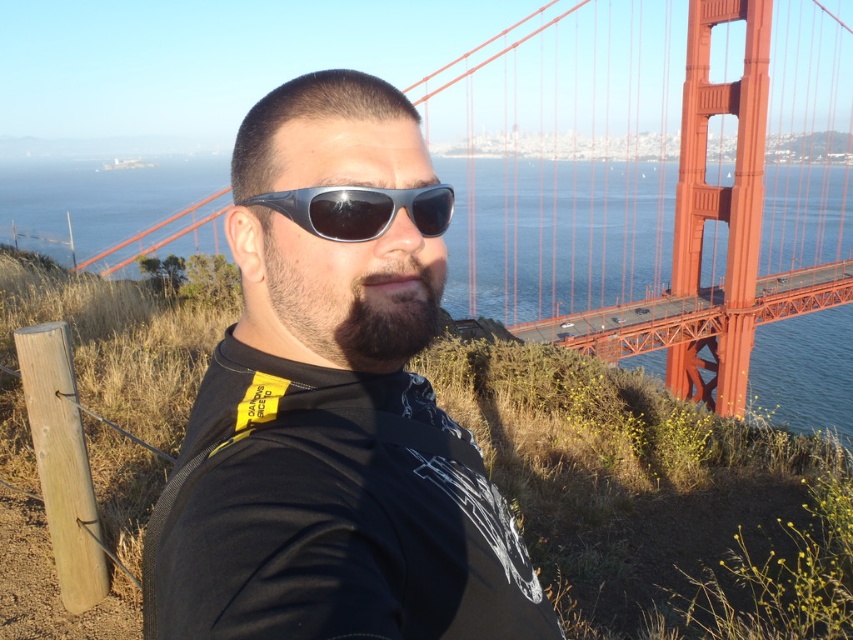
Is point (328, 150) behind point (431, 193)?

No.

Is black matte sunglasses at center taller than sunglasses at center?

Yes.

You are a GUI agent. You are given a task and a screenshot of the screen. Output one action in this format:
    pyautogui.click(x=<x>, y=<y>)
    Task: Click on the black matte sunglasses at center
    Image resolution: width=853 pixels, height=640 pixels.
    Given the screenshot: What is the action you would take?
    pyautogui.click(x=334, y=404)

The image size is (853, 640). Identify the location of black matte sunglasses at center. (334, 404).

Is red painted steel golden gate bridge at center above sunglasses at center?

Indeed, red painted steel golden gate bridge at center is positioned over sunglasses at center.

Who is more forward, [561,33] or [399,189]?

Positioned in front is point [399,189].

Image resolution: width=853 pixels, height=640 pixels. I want to click on red painted steel golden gate bridge at center, so click(x=570, y=173).

Does black matte sunglasses at center have a lesser height compared to red painted steel golden gate bridge at center?

Yes.

Can you confirm if black matte sunglasses at center is smaller than red painted steel golden gate bridge at center?

Yes, black matte sunglasses at center is smaller than red painted steel golden gate bridge at center.

Which is in front, point (286, 474) or point (776, 160)?

Point (286, 474) is more forward.

This screenshot has height=640, width=853. In order to click on black matte sunglasses at center in this screenshot , I will do `click(334, 404)`.